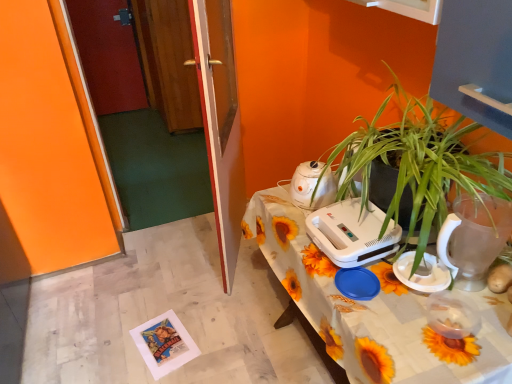
Identify the location of free spot in front of white plastic plate at lower right, positioned as the 3th appliance in back-to-front order. The width and height of the screenshot is (512, 384). (435, 334).